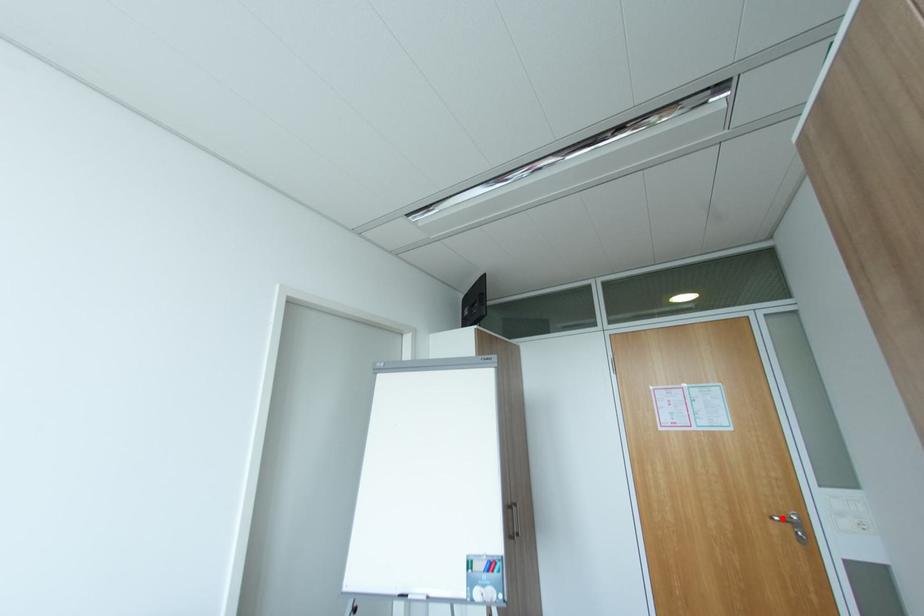
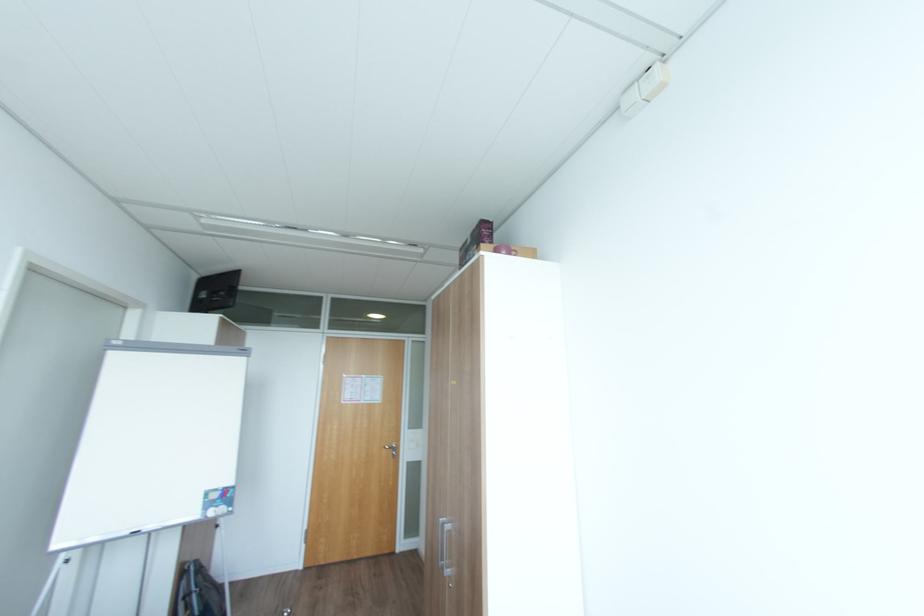
Question: I am providing you with two images of the same scene from different viewpoints. In image1, a red point is highlighted. Considering the same 3D point in image2, which of the following is correct?

Choices:
 (A) It is closer
 (B) It is farther

Answer: (B)